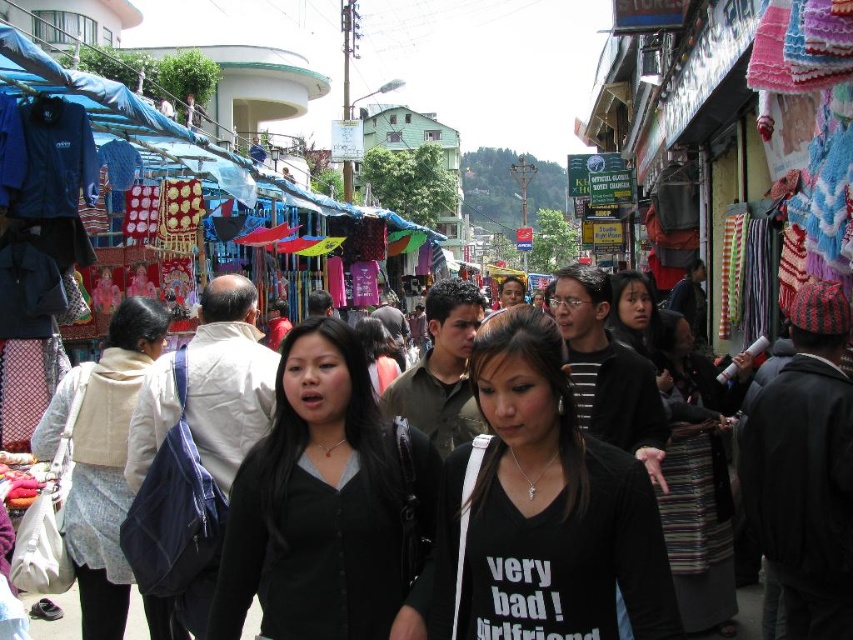
Does beige fabric bag at center appear over black fabric at center?

No.

Can you confirm if beige fabric bag at center is wider than black fabric at center?

Correct, the width of beige fabric bag at center exceeds that of black fabric at center.

Which is behind, point (113, 593) or point (374, 384)?

Positioned behind is point (374, 384).

At what (x,y) coordinates should I click in order to perform the action: click on beige fabric bag at center. Please return your answer as a coordinate pair (x, y). The width and height of the screenshot is (853, 640). Looking at the image, I should click on (107, 465).

Is point (579, 579) positioned behind point (152, 634)?

No, it is in front of (152, 634).

This screenshot has width=853, height=640. I want to click on black matte shirt at center, so click(x=540, y=509).

Is point (297, 604) positioned after point (396, 369)?

No.

Who is positioned more to the right, black matte cardigan at center or black fabric at center?

Positioned to the right is black matte cardigan at center.

Which is in front, point (222, 614) or point (368, 358)?

Point (222, 614) is in front.

The image size is (853, 640). I want to click on black matte cardigan at center, so click(x=325, y=502).